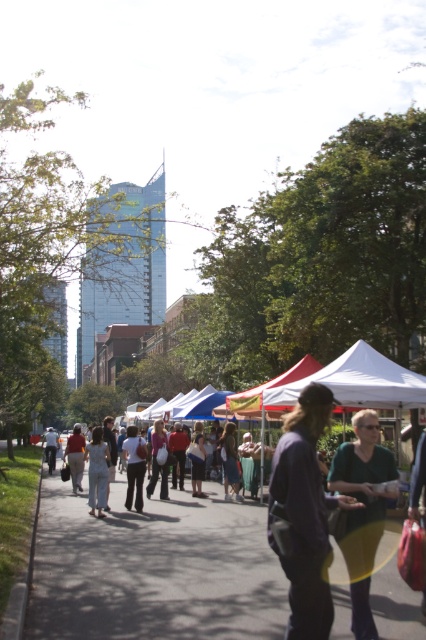
Question: Where is green fabric bag at center located in relation to white cotton shirt at center in the image?

Choices:
 (A) below
 (B) above

Answer: (B)

Question: Which point is closer to the camera?

Choices:
 (A) (249, 401)
 (B) (48, 451)
 (C) (100, 480)
 (D) (129, 444)

Answer: (C)

Question: Which of the following is the closest to the observer?

Choices:
 (A) light blue denim dress at center
 (B) dark purple shirt at center
 (C) green fabric bag at center

Answer: (B)

Question: Does dark purple shirt at center lie in front of red fabric canopy at center?

Choices:
 (A) no
 (B) yes

Answer: (B)

Question: Does dark purple shirt at center have a greater width compared to green fabric bag at center?

Choices:
 (A) yes
 (B) no

Answer: (A)

Question: Estimate the real-world distances between objects in this image. Which object is closer to the red fabric canopy at center?

Choices:
 (A) dark purple shirt at center
 (B) light blue denim dress at center
 (C) light gray pants at center

Answer: (B)